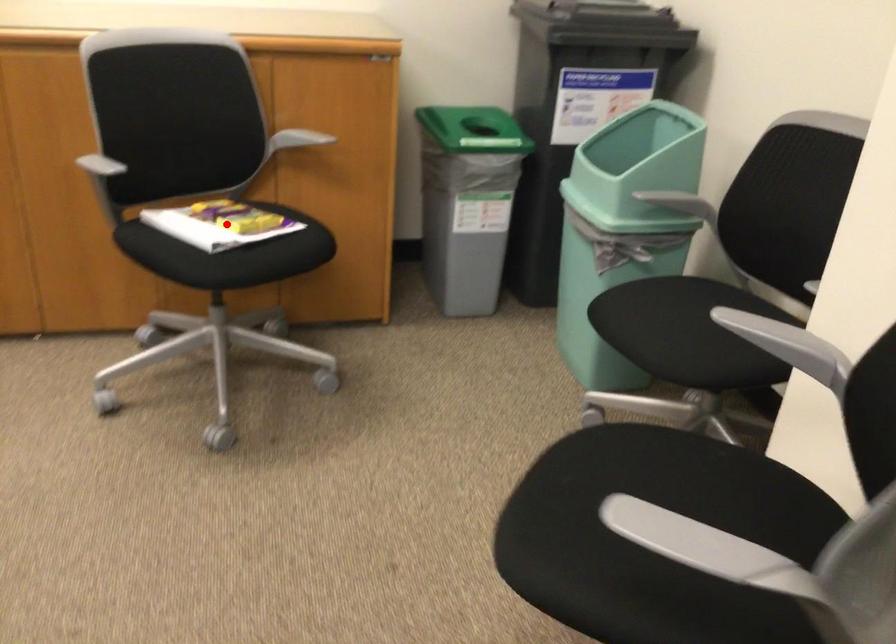
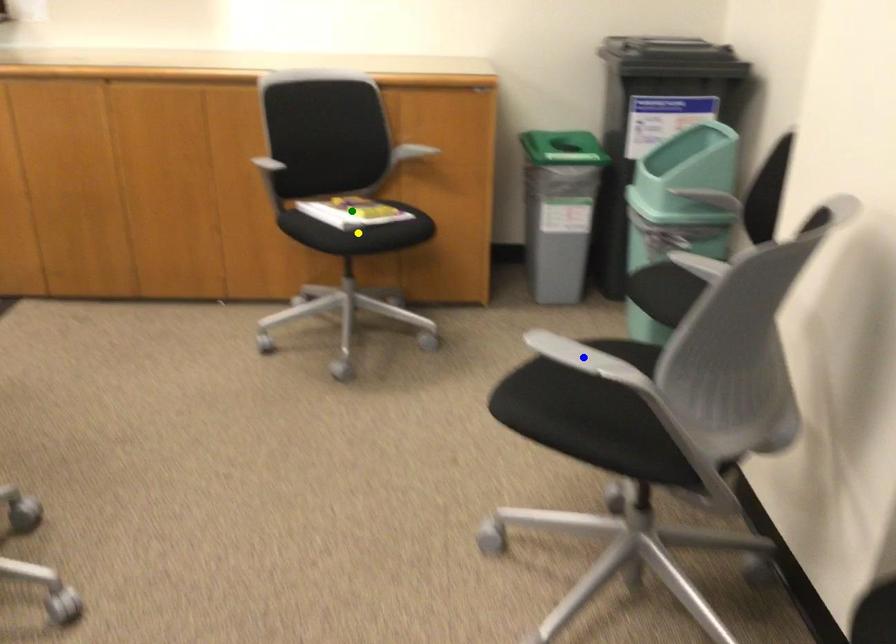
Question: I am providing you with two images of the same scene from different viewpoints. A red point is marked on the first image. You are given multiple points on the second image. In image 2, which mark is for the same physical point as the one in image 1?

Choices:
 (A) blue point
 (B) yellow point
 (C) green point

Answer: (C)